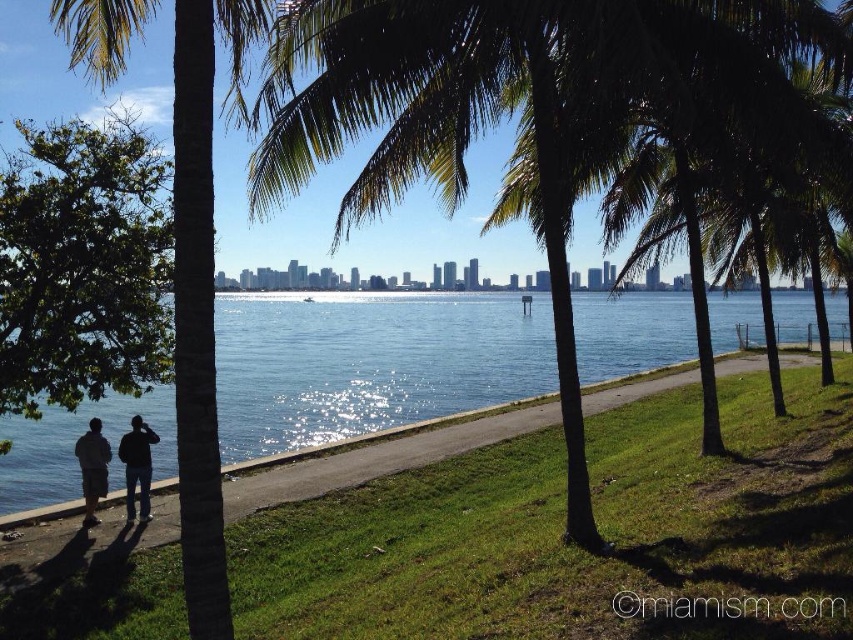
Can you confirm if green leafy tree at left is wider than black fabric person at lower left?

Indeed, green leafy tree at left has a greater width compared to black fabric person at lower left.

This screenshot has width=853, height=640. What do you see at coordinates (83, 264) in the screenshot? I see `green leafy tree at left` at bounding box center [83, 264].

Where is `green leafy tree at left`? The width and height of the screenshot is (853, 640). green leafy tree at left is located at coordinates (83, 264).

Is point (3, 321) farther from camera compared to point (149, 442)?

No, it is in front of (149, 442).

At what (x,y) coordinates should I click in order to perform the action: click on green leafy tree at left. Please return your answer as a coordinate pair (x, y). The width and height of the screenshot is (853, 640). Looking at the image, I should click on (83, 264).

The image size is (853, 640). Identify the location of green leafy tree at left. (83, 264).

Who is lower down, dark gray casual clothing at lower left or black fabric person at lower left?

black fabric person at lower left is below.

Is dark gray casual clothing at lower left smaller than black fabric person at lower left?

Indeed, dark gray casual clothing at lower left has a smaller size compared to black fabric person at lower left.

Where is `dark gray casual clothing at lower left`? This screenshot has height=640, width=853. dark gray casual clothing at lower left is located at coordinates (137, 465).

Identify the location of dark gray casual clothing at lower left. This screenshot has height=640, width=853. (137, 465).